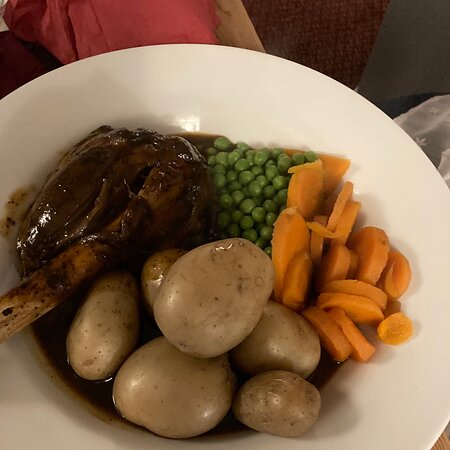
At what (x,y) coordinates should I click in order to perform the action: click on crumb. Please return your answer as a coordinate pair (x, y). This screenshot has height=450, width=450. Looking at the image, I should click on (21, 231), (28, 197).